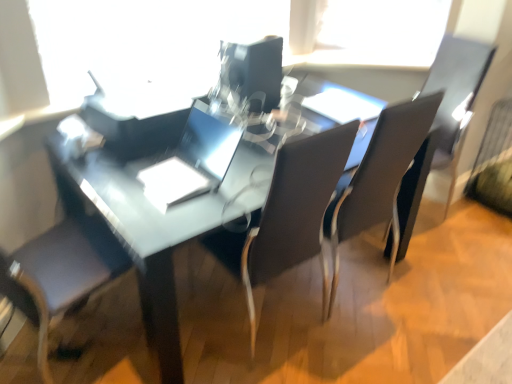
Where is `free point in front of sleek silver laptop at center`? free point in front of sleek silver laptop at center is located at coordinates (162, 212).